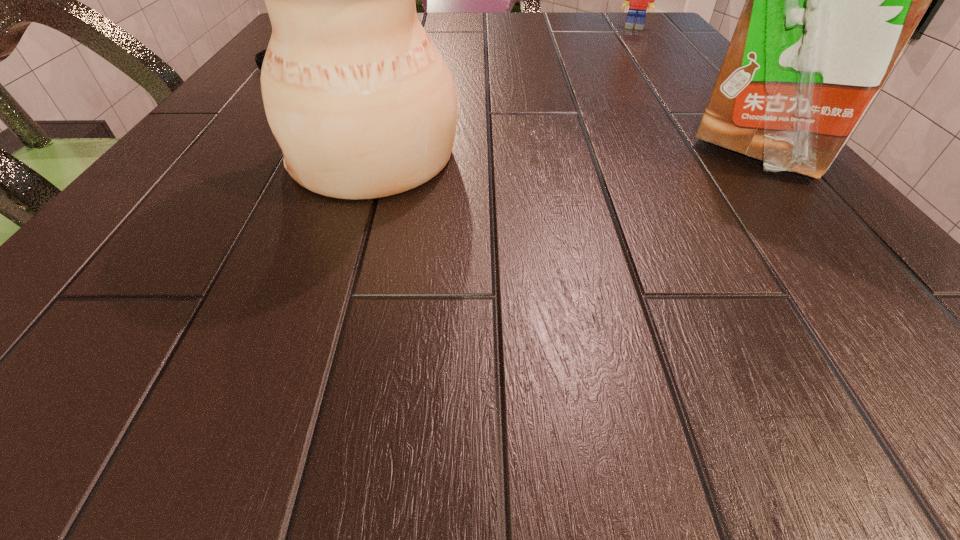
You are a GUI agent. You are given a task and a screenshot of the screen. Output one action in this format:
    pyautogui.click(x=<x>, y=<y>)
    Task: Click on the pottery
    
    Given the screenshot: What is the action you would take?
    pyautogui.click(x=363, y=106)

At what (x,y) coordinates should I click in order to perform the action: click on carton. Please return your answer as a coordinate pair (x, y). The height and width of the screenshot is (540, 960). Looking at the image, I should click on (x=831, y=1).

I want to click on the third nearest object, so click(x=259, y=57).

The width and height of the screenshot is (960, 540). In order to click on wristband in this screenshot , I will do [x=259, y=57].

Locate an element on the screen. The image size is (960, 540). the farthest object is located at coordinates (639, 0).

You are a GUI agent. You are given a task and a screenshot of the screen. Output one action in this format:
    pyautogui.click(x=<x>, y=<y>)
    Task: Click on the Lego
    The height and width of the screenshot is (540, 960).
    Given the screenshot: What is the action you would take?
    pyautogui.click(x=639, y=0)

I want to click on vacant space situated at the open side of the third object from right to left, so click(257, 156).

Image resolution: width=960 pixels, height=540 pixels. I want to click on vacant space situated 0.150m at the open side of the third object from right to left, so click(189, 156).

The image size is (960, 540). I want to click on vacant space positioned 0.160m on the straw side of the carton, so click(x=861, y=270).

At what (x,y) coordinates should I click in order to perform the action: click on vacant area situated 0.190m on the display of the third nearest object. Please return your answer as a coordinate pair (x, y). The image size is (960, 540). Looking at the image, I should click on (388, 92).